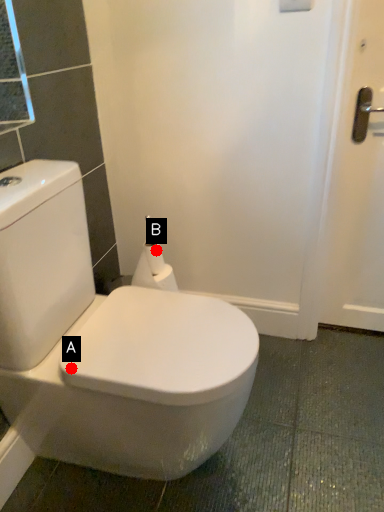
Question: Two points are circled on the image, labeled by A and B beside each circle. Which point is farther from the camera taking this photo?

Choices:
 (A) A is further
 (B) B is further

Answer: (B)